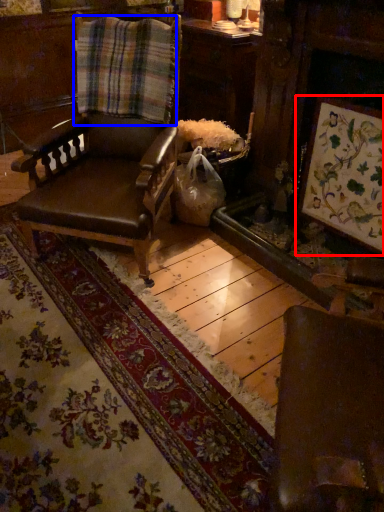
Question: Among these objects, which one is farthest to the camera, picture frame (highlighted by a red box) or plaid (highlighted by a blue box)?

Choices:
 (A) picture frame
 (B) plaid

Answer: (B)